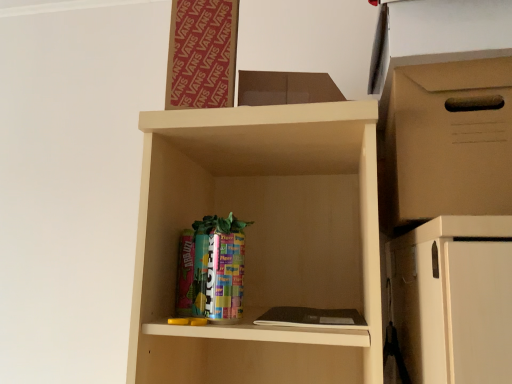
Question: Based on their positions, is red cardboard bulletin board at upper center located to the left or right of brown cardboard box at right?

Choices:
 (A) left
 (B) right

Answer: (A)

Question: In terms of width, does red cardboard bulletin board at upper center look wider or thinner when compared to brown cardboard box at right?

Choices:
 (A) wide
 (B) thin

Answer: (B)

Question: Considering the positions of red cardboard bulletin board at upper center and brown cardboard box at right in the image, is red cardboard bulletin board at upper center taller or shorter than brown cardboard box at right?

Choices:
 (A) tall
 (B) short

Answer: (A)

Question: In the image, is brown cardboard box at right on the left side or the right side of red cardboard bulletin board at upper center?

Choices:
 (A) left
 (B) right

Answer: (B)

Question: From the image's perspective, is brown cardboard box at right positioned above or below red cardboard bulletin board at upper center?

Choices:
 (A) below
 (B) above

Answer: (A)

Question: From a real-world perspective, relative to red cardboard bulletin board at upper center, is brown cardboard box at right vertically above or below?

Choices:
 (A) below
 (B) above

Answer: (A)

Question: Do you think brown cardboard box at right is within red cardboard bulletin board at upper center, or outside of it?

Choices:
 (A) outside
 (B) inside

Answer: (A)